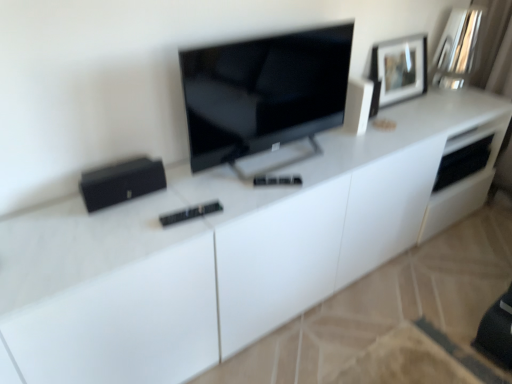
In order to click on free space in front of white glossy speaker at upper right, the 2th appliance from the left in this screenshot , I will do `click(349, 152)`.